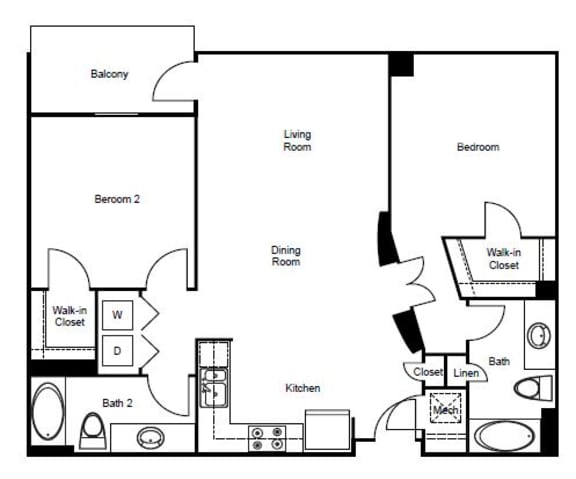
Where is `closet`? Image resolution: width=576 pixels, height=479 pixels. closet is located at coordinates (66, 315), (497, 254).